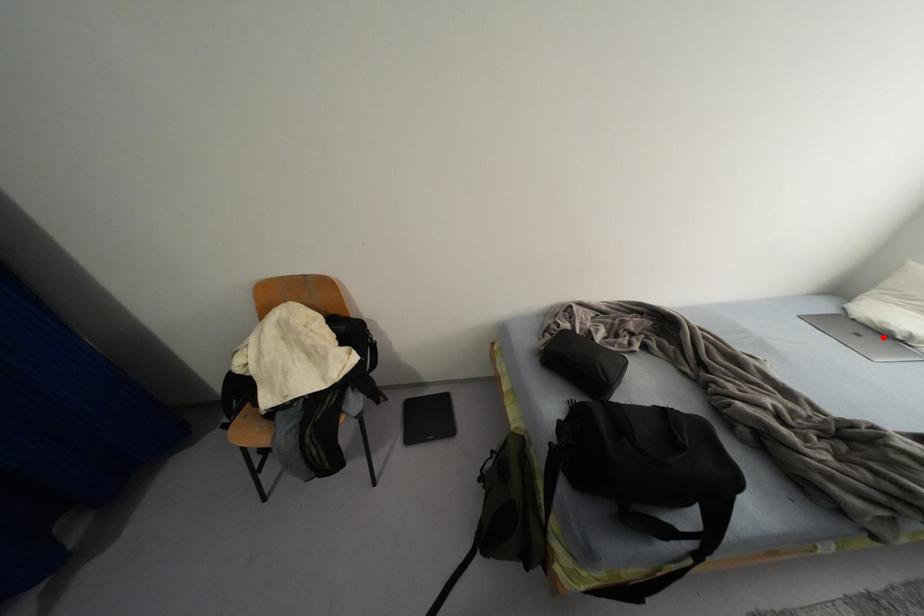
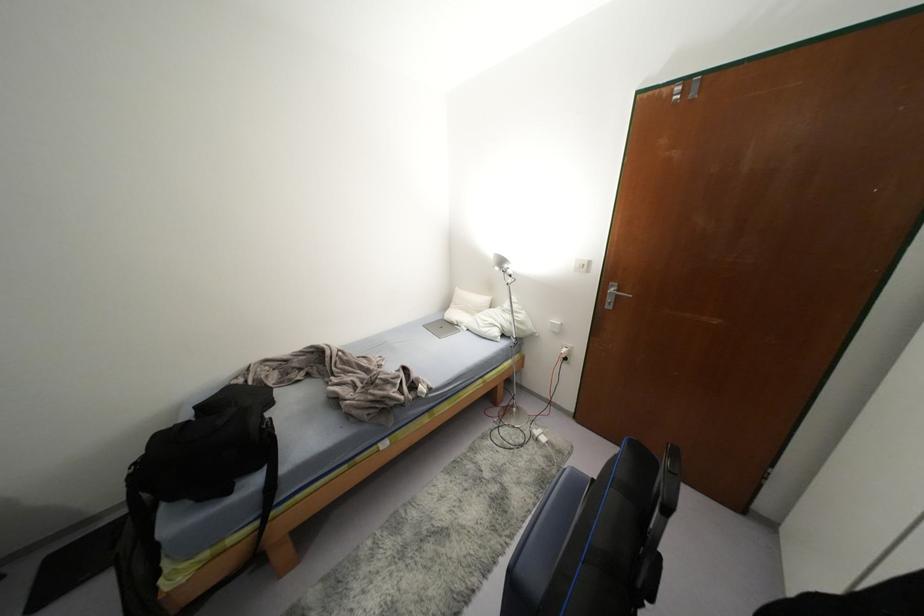
Question: A red point is marked in image1. In image2, is the corresponding 3D point closer to the camera or farther? Reply with the corresponding letter.

Choices:
 (A) The corresponding 3D point is closer.
 (B) The corresponding 3D point is farther.

Answer: (A)